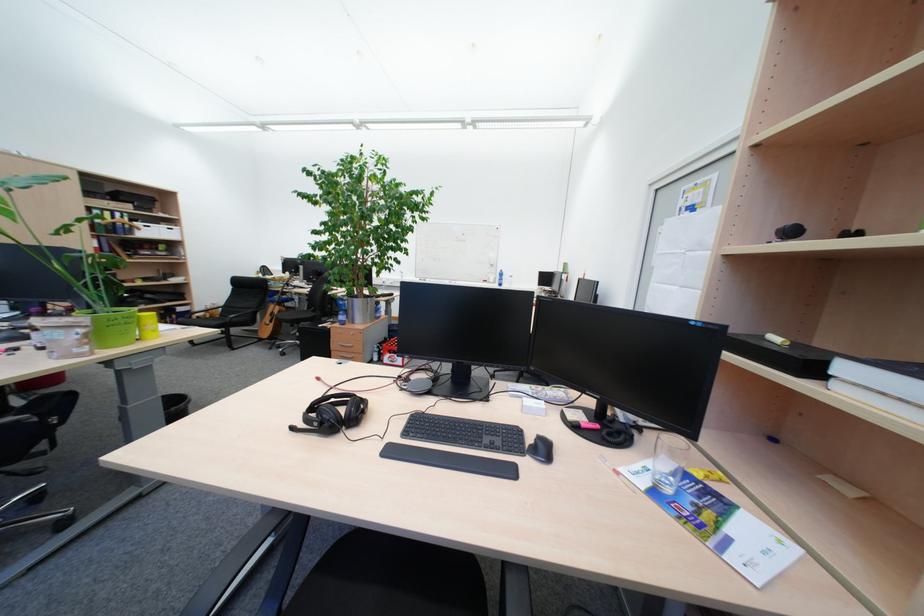
Find where to lift the yellow cylindrical cup. Please return your answer as a coordinate pair (x, y).

(148, 325)